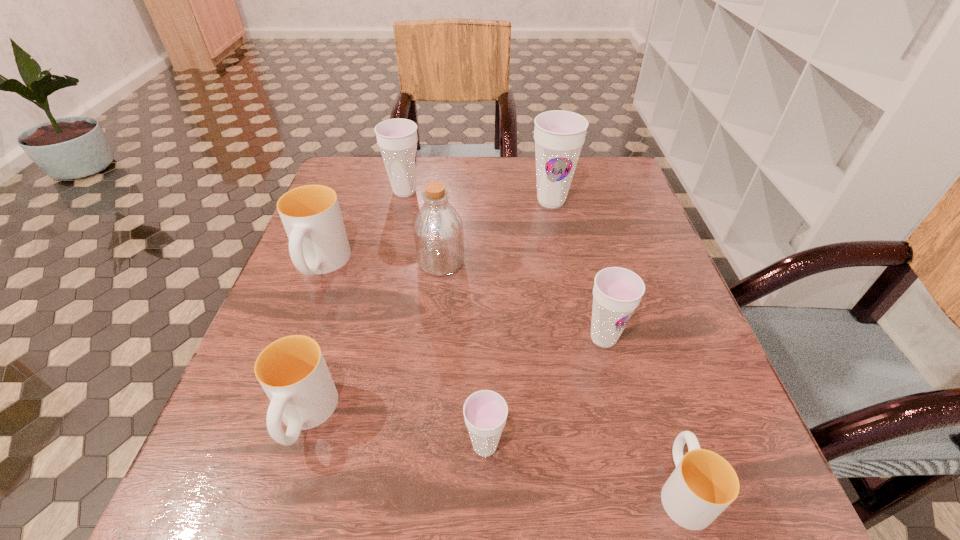
The height and width of the screenshot is (540, 960). Find the location of `free space located with the handle on the side of the shortest object`. free space located with the handle on the side of the shortest object is located at coordinates (654, 399).

At what (x,y) coordinates should I click in order to perform the action: click on free space located 0.220m with the handle on the side of the shortest object. Please return your answer as a coordinate pair (x, y). Image resolution: width=960 pixels, height=540 pixels. Looking at the image, I should click on point(635,337).

Where is `blank space located with the handle on the side of the shortest object`? The height and width of the screenshot is (540, 960). blank space located with the handle on the side of the shortest object is located at coordinates (628, 316).

This screenshot has height=540, width=960. I want to click on object that is at the far left corner, so click(397, 138).

This screenshot has height=540, width=960. Identify the location of object that is at the near right corner. (703, 484).

Locate an element on the screen. This screenshot has height=540, width=960. vacant space at the near edge of the desktop is located at coordinates (555, 503).

The width and height of the screenshot is (960, 540). In the image, there is a desktop. What are the coordinates of `free space at the left edge` in the screenshot? It's located at (254, 400).

This screenshot has width=960, height=540. In the image, there is a desktop. Find the location of `vacant space at the right edge`. vacant space at the right edge is located at coordinates (713, 443).

The width and height of the screenshot is (960, 540). What are the coordinates of `vacant space at the far right corner of the desktop` in the screenshot? It's located at (595, 191).

The width and height of the screenshot is (960, 540). In order to click on vacant space at the near right corner in this screenshot , I will do `click(781, 522)`.